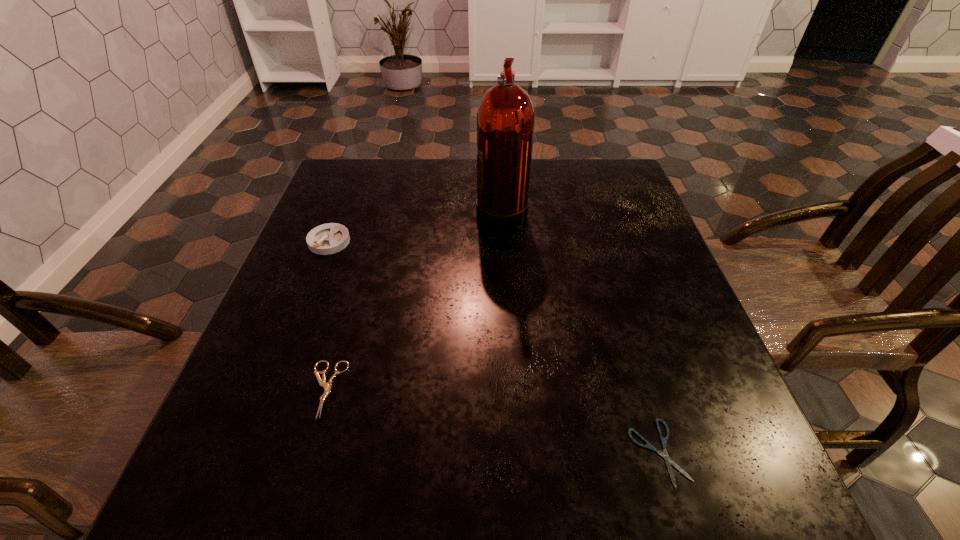
This screenshot has height=540, width=960. I want to click on vacant space at the far edge of the desktop, so click(532, 180).

This screenshot has height=540, width=960. In the image, there is a desktop. Find the location of `free space at the near edge`. free space at the near edge is located at coordinates point(401,484).

Where is `vacant space at the left edge`? This screenshot has height=540, width=960. vacant space at the left edge is located at coordinates (257, 440).

In the image, there is a desktop. Where is `blank space at the right edge`? blank space at the right edge is located at coordinates (652, 267).

At what (x,y) coordinates should I click in order to perform the action: click on free space at the far left corner. Please return your answer as a coordinate pair (x, y). Looking at the image, I should click on (356, 177).

Image resolution: width=960 pixels, height=540 pixels. Find the location of `blank space at the far right corner of the desktop`. blank space at the far right corner of the desktop is located at coordinates pos(615,197).

Locate an element on the screen. The width and height of the screenshot is (960, 540). vacant area between the leftmost object and the third object from left to right is located at coordinates (416, 226).

The width and height of the screenshot is (960, 540). Find the location of `free area in between the second object from right to left and the leftmost object`. free area in between the second object from right to left and the leftmost object is located at coordinates (416, 226).

I want to click on empty location between the third object from left to right and the rightmost object, so click(x=580, y=332).

Identify the location of empty space between the tallest object and the second object from left to right. This screenshot has height=540, width=960. (414, 300).